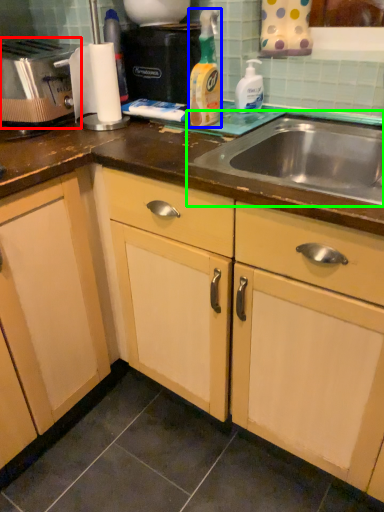
Question: Considering the real-world distances, which object is farthest from toaster (highlighted by a red box)? cleaning product (highlighted by a blue box) or sink (highlighted by a green box)?

Choices:
 (A) cleaning product
 (B) sink

Answer: (B)